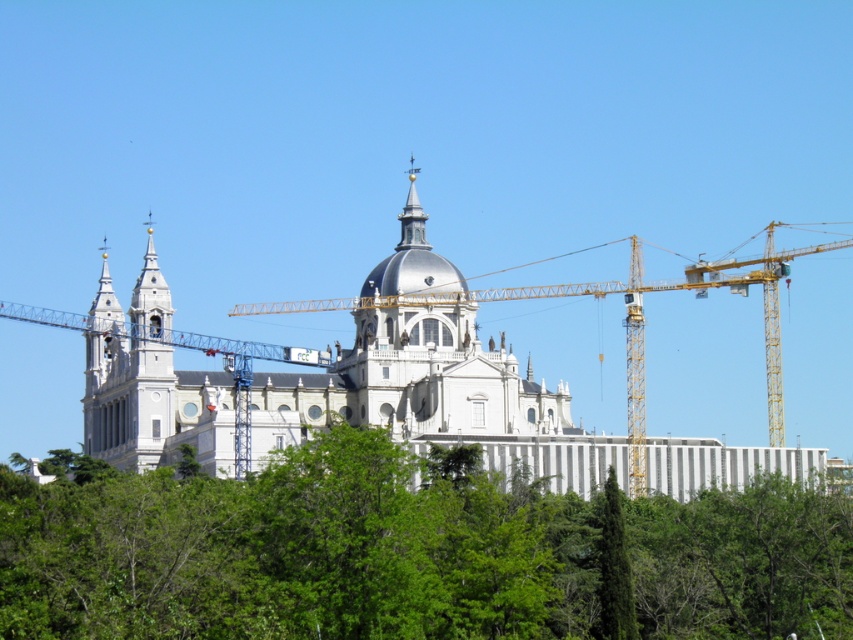
Question: Which point is farther to the camera?

Choices:
 (A) green leafy tree at center
 (B) green leafy tree at lower right

Answer: (B)

Question: Which is nearer to the polished silver spire at center?

Choices:
 (A) white stone church at center
 (B) green leafy tree at lower right
 (C) green leafy tree at center

Answer: (A)

Question: Can you confirm if green leafy tree at center is smaller than green leafy tree at lower right?

Choices:
 (A) no
 (B) yes

Answer: (A)

Question: Is green leafy tree at lower right thinner than polished silver spire at center?

Choices:
 (A) yes
 (B) no

Answer: (A)

Question: Can you confirm if green leafy tree at center is positioned above polished silver spire at center?

Choices:
 (A) yes
 (B) no

Answer: (B)

Question: Which of these objects is positioned farthest from the green leafy tree at center?

Choices:
 (A) white stone church at center
 (B) green leafy tree at lower right

Answer: (A)